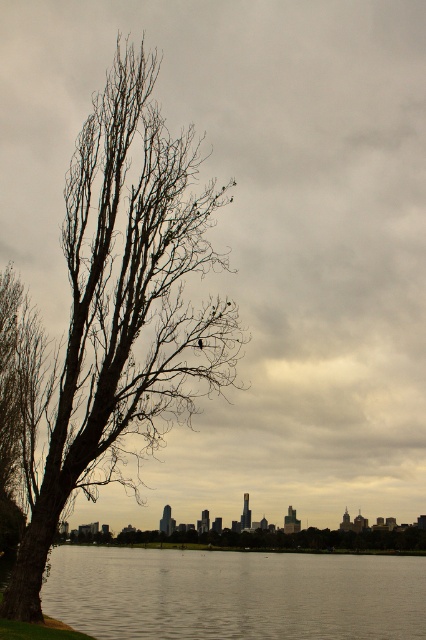
Looking at this image, you are a photographer trying to capture the entire scene in one shot. Given that the smooth gray water at lower center and the bare wood tree at left are both in your frame, which object would occupy more of the visual space?

The smooth gray water at lower center occupies more visual space because it is larger in size compared to the bare wood tree at left as stated in the object description.

You are an artist sketching the scene and want to ensure the proportions are accurate. Which object among the bare branches at left and the bare wood tree at left should you draw taller?

The bare branches at left should be drawn taller since they have a greater height compared to the bare wood tree at left according to the description.

You are standing in front of a large tree and want to place two markers at specific coordinates. The first marker is at point (127, 252) and the second at point (92, 632). Which marker will appear closer to you when viewed from your current position?

The marker at point (127, 252) will appear closer to you because it is closer to the viewer than point (92, 632) according to the spatial description provided.